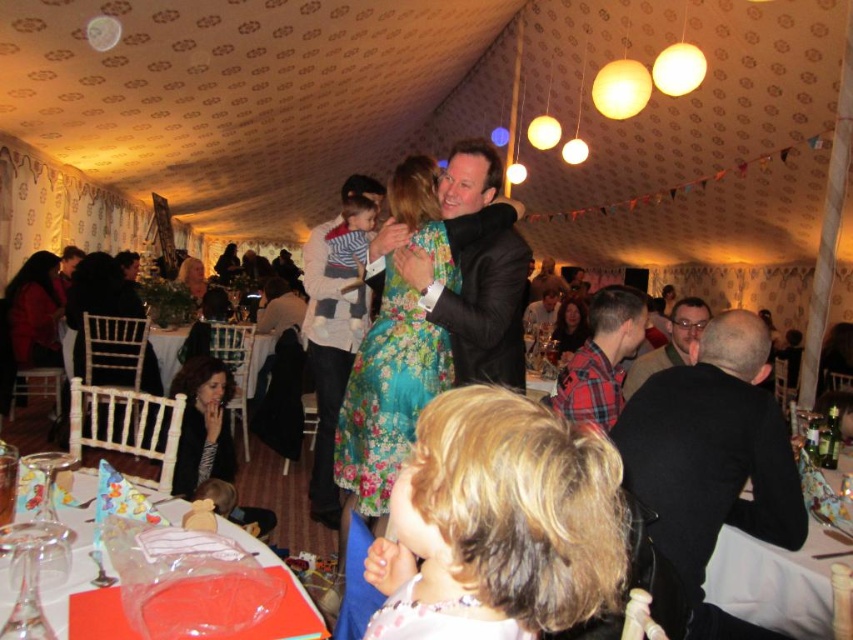
Question: Which object appears farthest from the camera in this image?

Choices:
 (A) floral dress at center
 (B) dark brown leather jacket at lower left

Answer: (A)

Question: Does floral fabric dress at center have a smaller size compared to transparent plastic bag at lower center?

Choices:
 (A) no
 (B) yes

Answer: (A)

Question: Does black textured jacket at lower left have a smaller size compared to matte black suit at lower left?

Choices:
 (A) yes
 (B) no

Answer: (B)

Question: Which point is farther to the camera?

Choices:
 (A) (74, 314)
 (B) (674, 337)
 (C) (419, 349)
 (D) (395, 573)

Answer: (A)

Question: Which object appears farthest from the camera in this image?

Choices:
 (A) blonde hair at center
 (B) floral fabric dress at center

Answer: (B)

Question: Does floral fabric dress at center appear on the left side of striped fabric shirt at center?

Choices:
 (A) no
 (B) yes

Answer: (A)